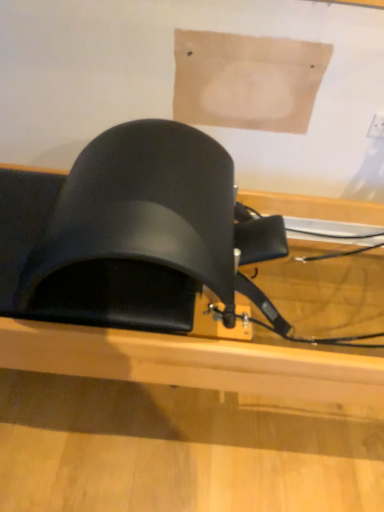
The height and width of the screenshot is (512, 384). Describe the element at coordinates (182, 428) in the screenshot. I see `matte black monitor at center` at that location.

Measure the distance between point (85, 351) and camera.

The depth of point (85, 351) is 1.03 meters.

Find the location of a particular element. matte black monitor at center is located at coordinates (182, 428).

Where is `matte black monitor at center`? The image size is (384, 512). matte black monitor at center is located at coordinates (182, 428).